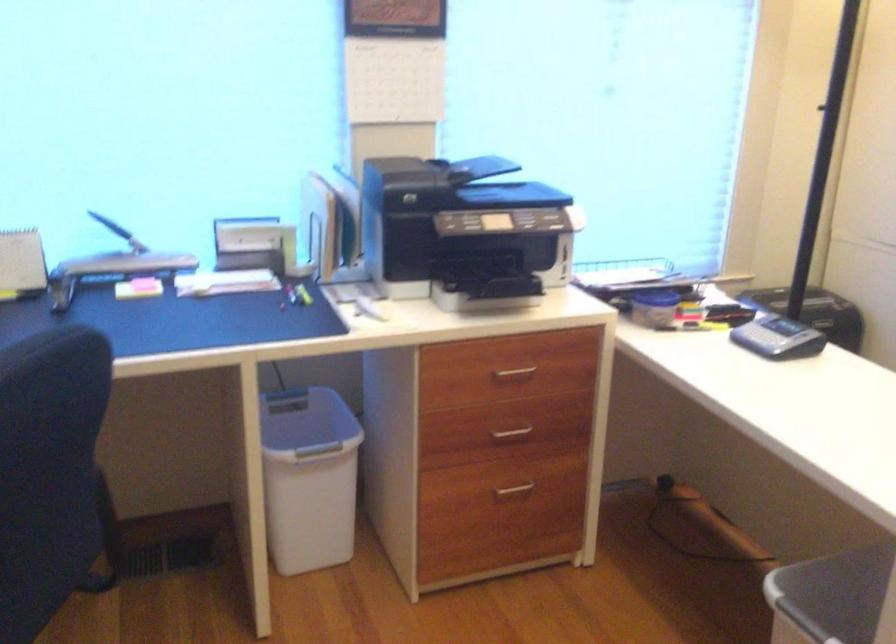
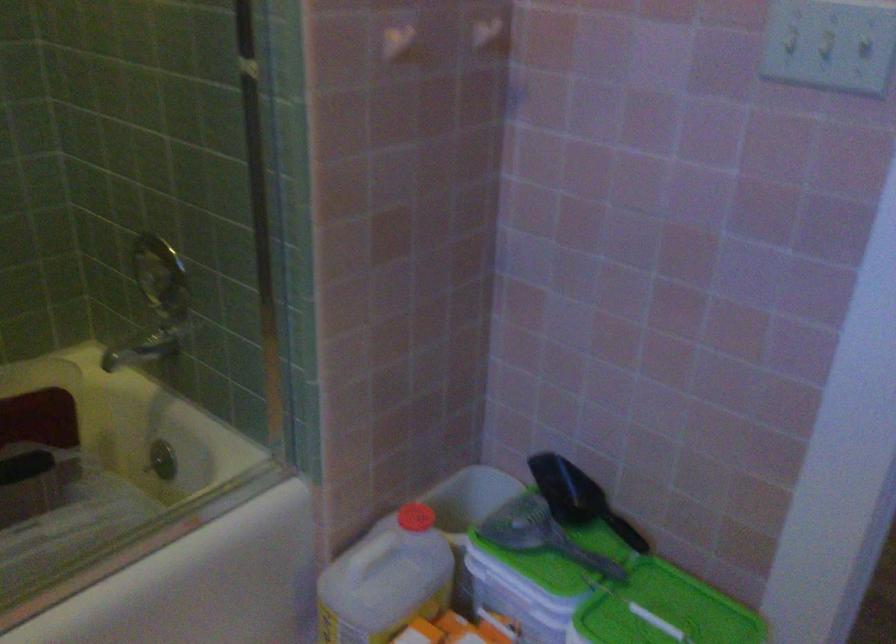
Question: I am providing you with two images of the same scene from different viewpoints. Please identify which objects are invisible in image2.

Choices:
 (A) grey scoop handle
 (B) shower faucet handle
 (C) drawer handle
 (D) blue and grey backpack

Answer: (C)